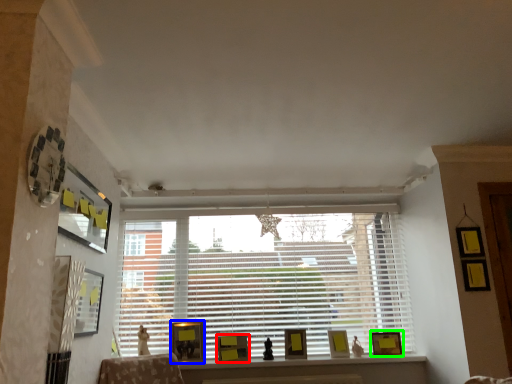
Question: Based on their relative distances, which object is nearer to picture frame (highlighted by a red box)? Choose from picture frame (highlighted by a blue box) and picture frame (highlighted by a green box).

Choices:
 (A) picture frame
 (B) picture frame

Answer: (A)